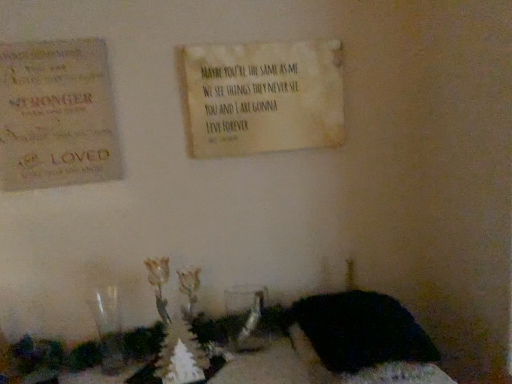
Question: Choose the correct answer: Is rustic wood sign at upper left inside beige textured sign at upper center or outside it?

Choices:
 (A) outside
 (B) inside

Answer: (A)

Question: Is rustic wood sign at upper left taller or shorter than beige textured sign at upper center?

Choices:
 (A) short
 (B) tall

Answer: (B)

Question: Estimate the real-world distances between objects in this image. Which object is farther from the rustic wood sign at upper left?

Choices:
 (A) black fabric at lower right
 (B) beige textured sign at upper center

Answer: (A)

Question: Which object is positioned farthest from the black fabric at lower right?

Choices:
 (A) rustic wood sign at upper left
 (B) beige textured sign at upper center

Answer: (A)